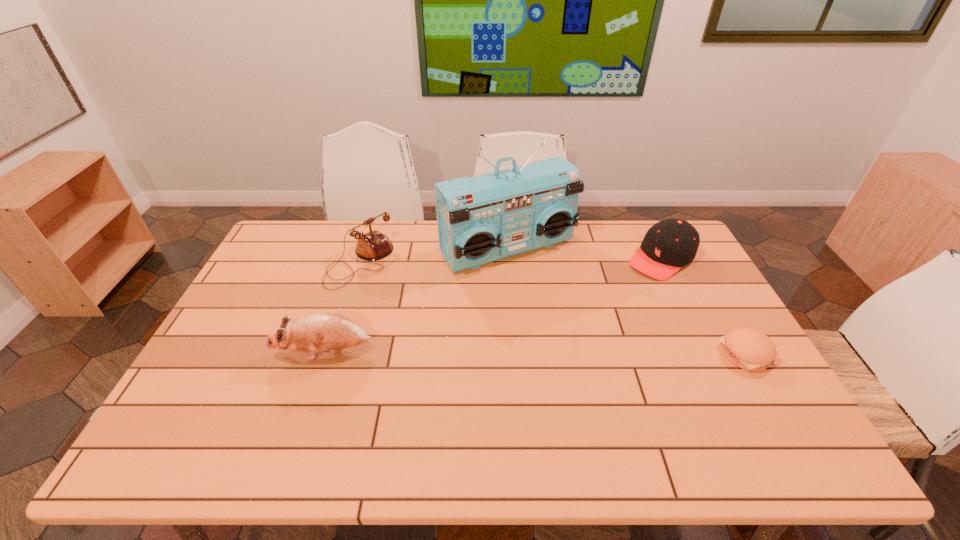
At what (x,y) coordinates should I click in order to perform the action: click on vacant space on the desktop that is between the hamster and the patty and is positioned on the rotary dial of the telephone. Please return your answer as a coordinate pair (x, y). Looking at the image, I should click on (486, 353).

Locate an element on the screen. Image resolution: width=960 pixels, height=540 pixels. vacant space on the desktop that is between the hamster and the patty and is positioned on the front-facing side of the tallest object is located at coordinates (593, 353).

Where is `vacant space on the desktop that is between the hamster and the patty and is positioned on the front-facing side of the cap`? The width and height of the screenshot is (960, 540). vacant space on the desktop that is between the hamster and the patty and is positioned on the front-facing side of the cap is located at coordinates (551, 353).